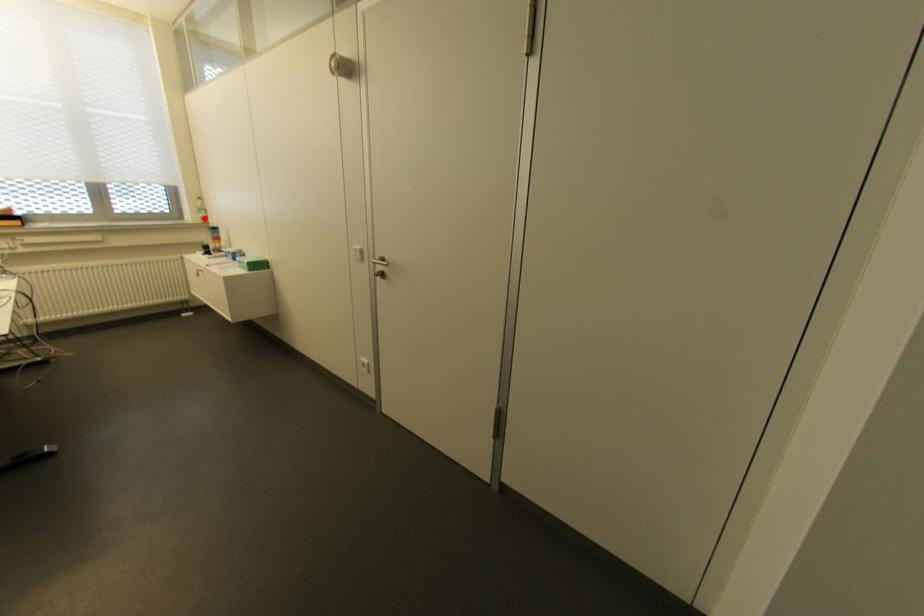
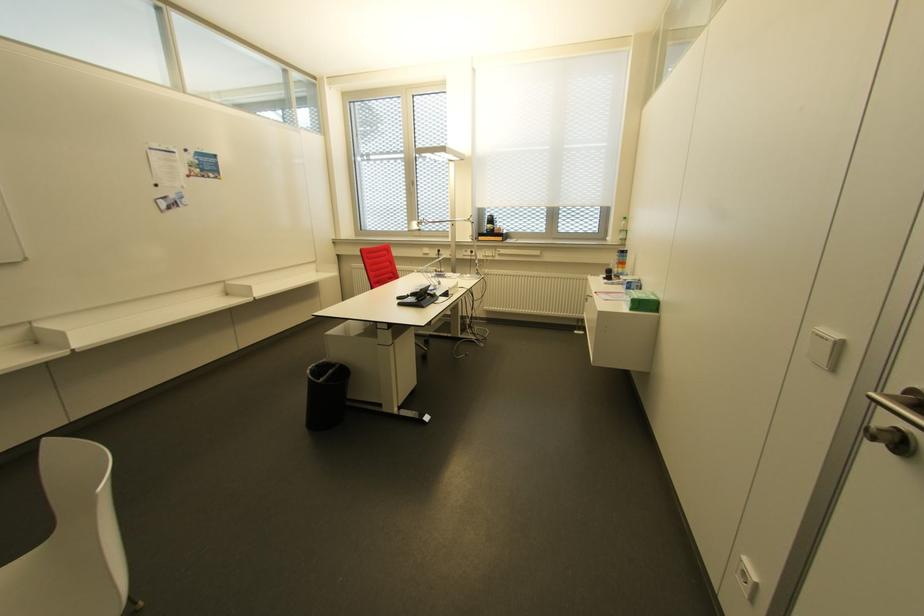
Question: I am providing you with two images of the same scene from different viewpoints. A red point is marked on the first image. Can you still see the location of the red point in image 2?

Choices:
 (A) Yes
 (B) No

Answer: (A)